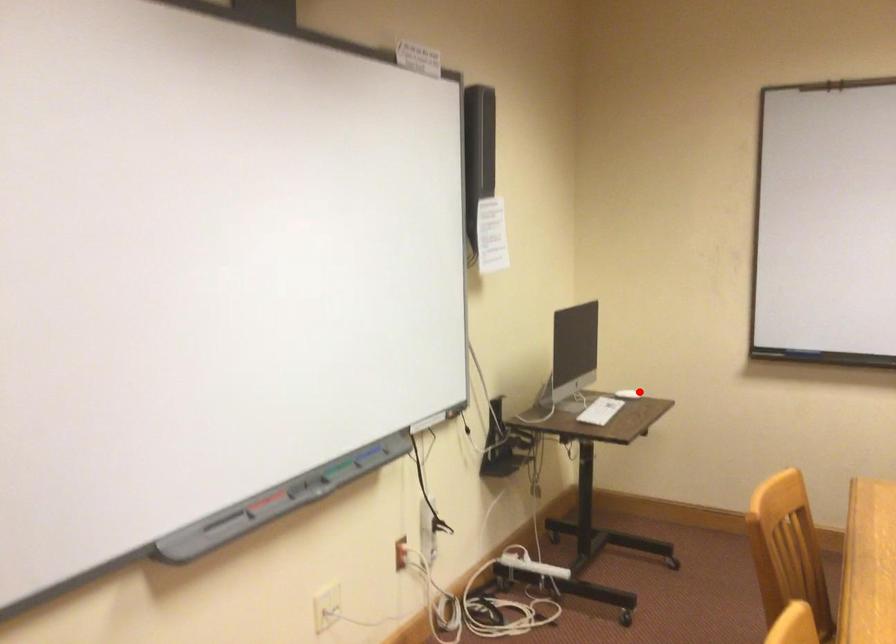
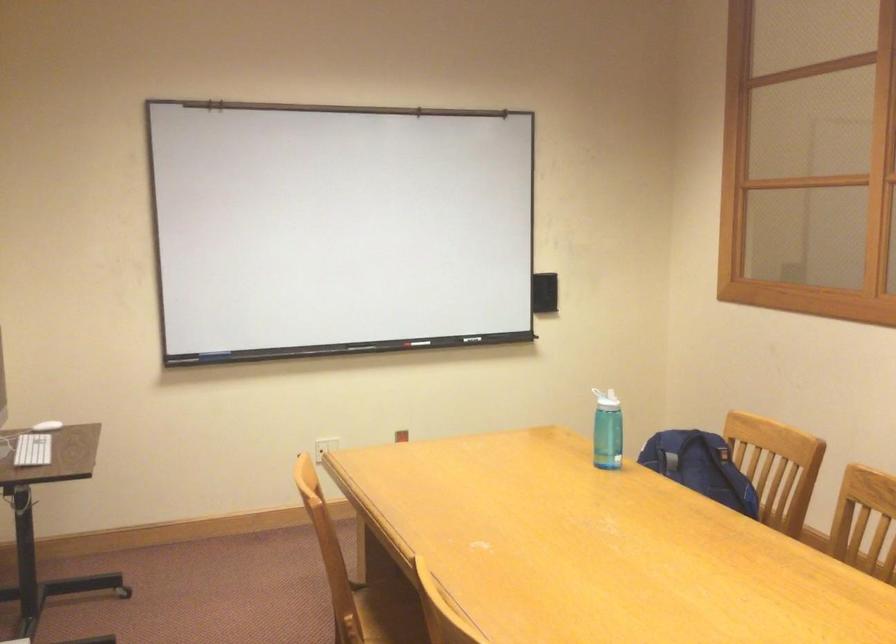
Question: I am providing you with two images of the same scene from different viewpoints. A red point is shown in image1. For the corresponding object point in image2, is it positioned nearer or farther from the camera?

Choices:
 (A) Nearer
 (B) Farther

Answer: (A)